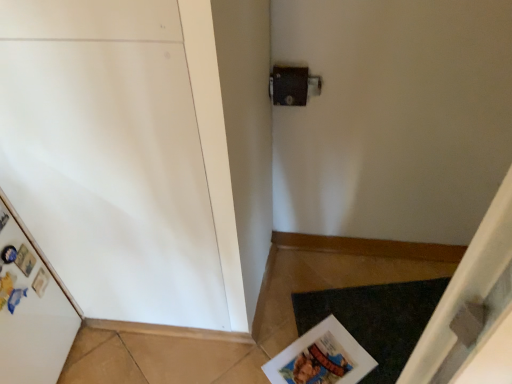
Question: Relative to dark gray carpet at lower right, is matte paper magazine at lower right in front or behind?

Choices:
 (A) behind
 (B) front

Answer: (B)

Question: From their relative heights in the image, would you say matte paper magazine at lower right is taller or shorter than dark gray carpet at lower right?

Choices:
 (A) short
 (B) tall

Answer: (B)

Question: From a real-world perspective, is matte paper magazine at lower right physically located above or below dark gray carpet at lower right?

Choices:
 (A) above
 (B) below

Answer: (A)

Question: Visually, is dark gray carpet at lower right positioned to the left or to the right of matte paper magazine at lower right?

Choices:
 (A) left
 (B) right

Answer: (B)

Question: Is dark gray carpet at lower right taller or shorter than matte paper magazine at lower right?

Choices:
 (A) tall
 (B) short

Answer: (B)

Question: Is dark gray carpet at lower right inside the boundaries of matte paper magazine at lower right, or outside?

Choices:
 (A) inside
 (B) outside

Answer: (B)

Question: From a real-world perspective, relative to matte paper magazine at lower right, is dark gray carpet at lower right vertically above or below?

Choices:
 (A) above
 (B) below

Answer: (B)